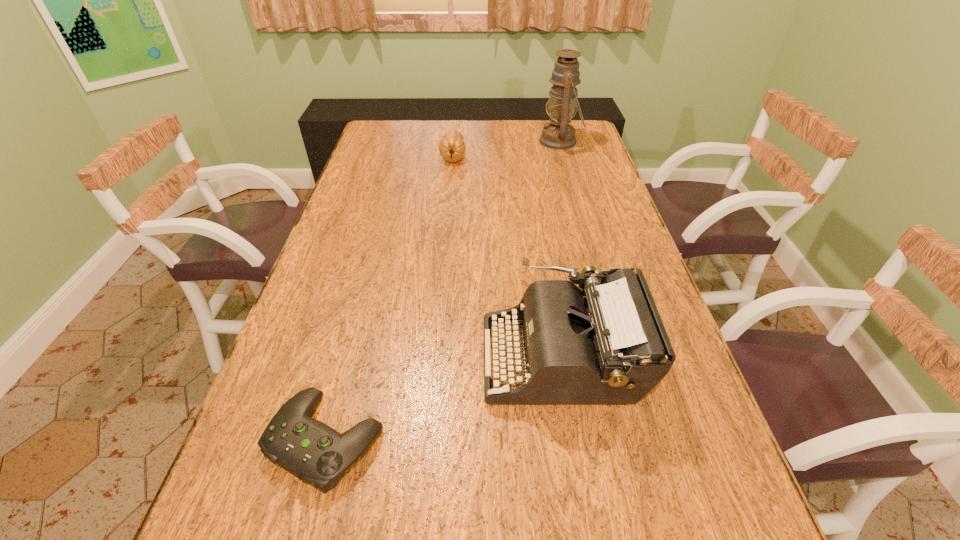
You are a GUI agent. You are given a task and a screenshot of the screen. Output one action in this format:
    pyautogui.click(x=<x>, y=<y>)
    Task: Click on the oil lamp
    The image size is (960, 540).
    Given the screenshot: What is the action you would take?
    [559, 135]

At what (x,y) coordinates should I click in order to perform the action: click on the third shortest object. Please return your answer as a coordinate pair (x, y). Looking at the image, I should click on (605, 344).

Locate an element on the screen. the second object from left to right is located at coordinates (452, 147).

The height and width of the screenshot is (540, 960). I want to click on gourd, so click(x=452, y=147).

I want to click on the shortest object, so pyautogui.click(x=315, y=453).

Where is `the leftmost object`? the leftmost object is located at coordinates (315, 453).

The width and height of the screenshot is (960, 540). In order to click on vacant space situated on the left of the oil lamp in this screenshot , I will do `click(461, 141)`.

Locate an element on the screen. This screenshot has width=960, height=540. vacant point located 0.200m on the front-facing side of the typewriter is located at coordinates (391, 357).

The width and height of the screenshot is (960, 540). I want to click on vacant region located on the front-facing side of the typewriter, so click(377, 357).

The height and width of the screenshot is (540, 960). I want to click on vacant space positioned 0.370m on the front-facing side of the typewriter, so click(312, 357).